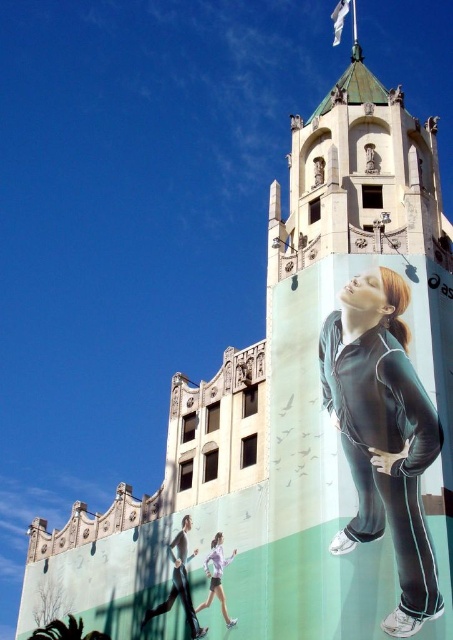
You are standing in front of the building and see the point at coordinates (x=384, y=435). What is the color of the clothing item located at that point?

The clothing item at point (x=384, y=435) is a matte black tracksuit at right.

You are standing in front of the architectural structure and want to determine which of the two points, point (202, 627) or point (218, 576), is closer to you. Based on the scene, which point is nearer?

Point (202, 627) is closer to the viewer than point (218, 576).